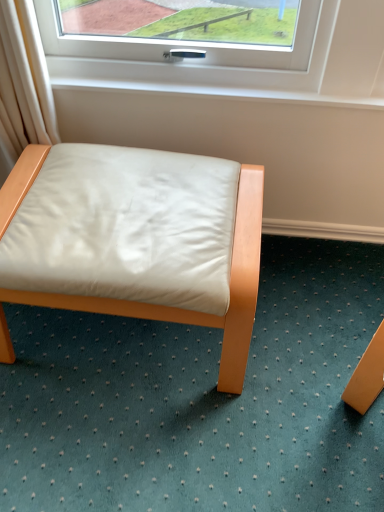
Identify the location of vacant space underneath white leather ottoman at center (from a real-world perspective). (129, 339).